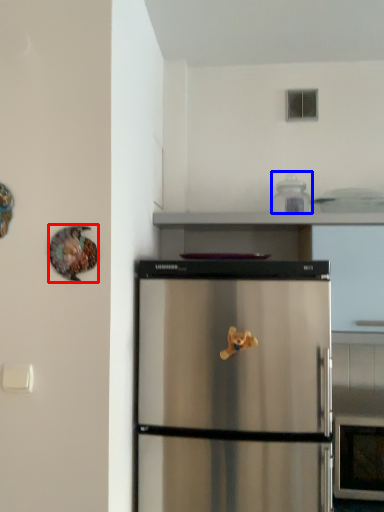
Question: Which point is closer to the camera, animal (highlighted by a red box) or appliance (highlighted by a blue box)?

Choices:
 (A) animal
 (B) appliance

Answer: (A)